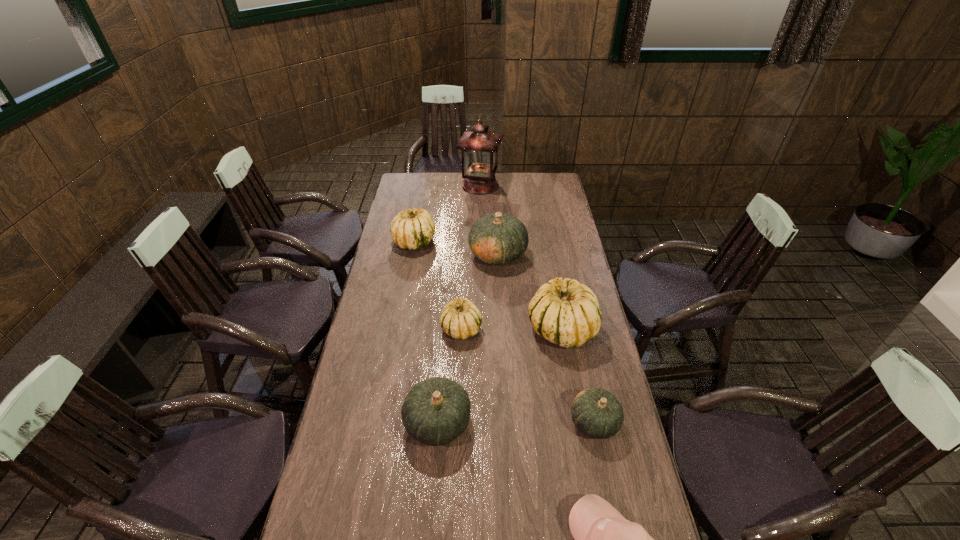
Identify which orange gourd is located as the nearest to the farthest object. Please provide its 2D coordinates. Your answer should be formatted as a tuple, i.e. [(x, y)], where the tuple contains the x and y coordinates of a point satisfying the conditions above.

[(497, 238)]

Identify which orange gourd is located as the second nearest to the second biggest orange gourd. Please provide its 2D coordinates. Your answer should be formatted as a tuple, i.e. [(x, y)], where the tuple contains the x and y coordinates of a point satisfying the conditions above.

[(497, 238)]

Select which white gourd appears as the second closest to the second biggest orange gourd. Please provide its 2D coordinates. Your answer should be formatted as a tuple, i.e. [(x, y)], where the tuple contains the x and y coordinates of a point satisfying the conditions above.

[(567, 313)]

Locate which white gourd ranks in proximity to the rightmost white gourd. Please provide its 2D coordinates. Your answer should be formatted as a tuple, i.e. [(x, y)], where the tuple contains the x and y coordinates of a point satisfying the conditions above.

[(461, 319)]

This screenshot has width=960, height=540. I want to click on vacant region that satisfies the following two spatial constraints: 1. on the back side of the second smallest orange gourd; 2. on the right side of the oil lamp, so click(x=456, y=185).